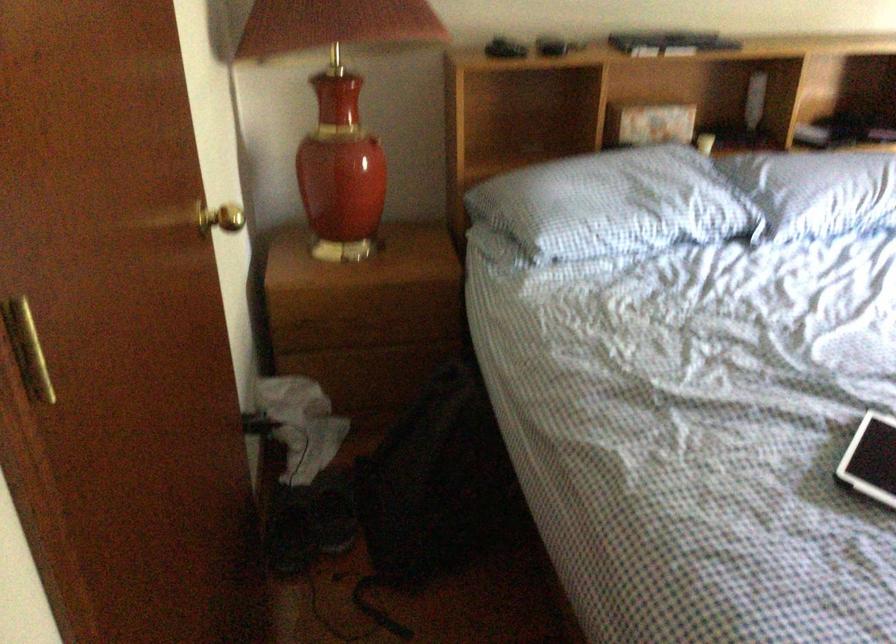
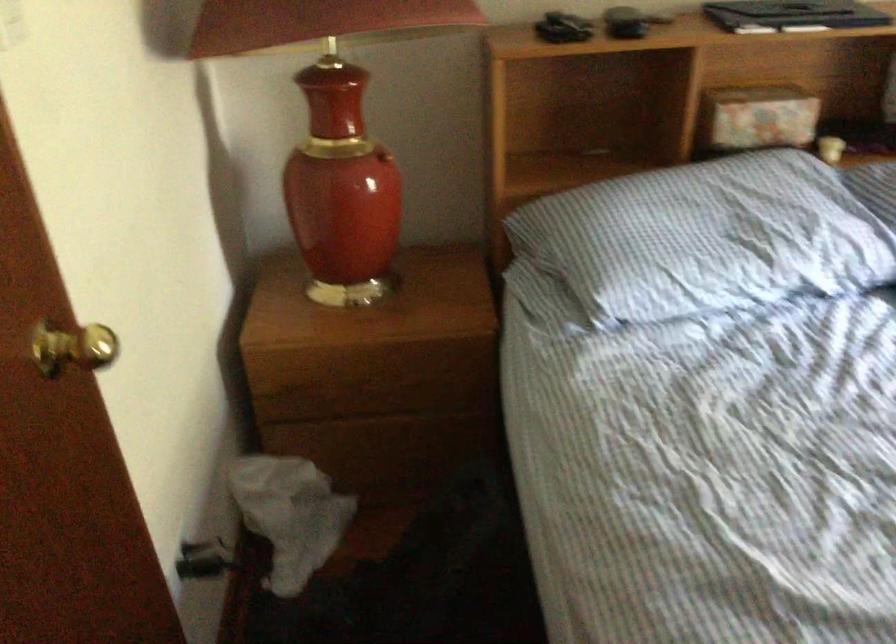
Where in the second image is the point corresponding to (x=209, y=222) from the first image?

(73, 348)